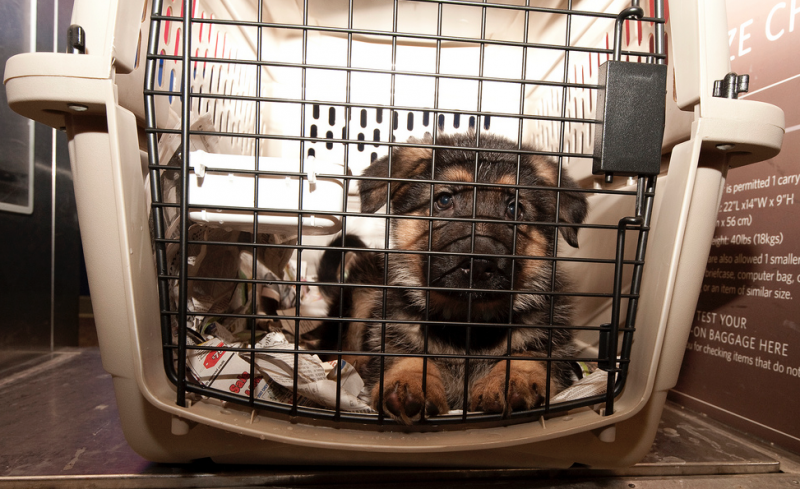
Where is `bottom panel`? The width and height of the screenshot is (800, 489). bottom panel is located at coordinates (290, 447).